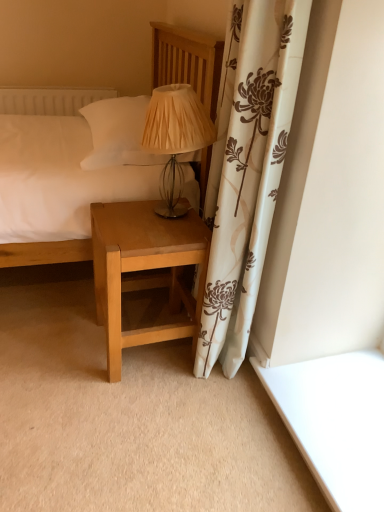
Question: In which direction should I rotate to look at light brown wood nightstand at lower center?

Choices:
 (A) right
 (B) left

Answer: (B)

Question: Considering the relative sizes of matte beige fabric lampshade at center and light brown wood nightstand at lower center in the image provided, is matte beige fabric lampshade at center shorter than light brown wood nightstand at lower center?

Choices:
 (A) no
 (B) yes

Answer: (B)

Question: Does matte beige fabric lampshade at center lie behind light brown wood nightstand at lower center?

Choices:
 (A) yes
 (B) no

Answer: (B)

Question: From the image's perspective, is matte beige fabric lampshade at center on light brown wood nightstand at lower center?

Choices:
 (A) yes
 (B) no

Answer: (A)

Question: Is matte beige fabric lampshade at center bigger than light brown wood nightstand at lower center?

Choices:
 (A) yes
 (B) no

Answer: (B)

Question: Is matte beige fabric lampshade at center completely or partially outside of light brown wood nightstand at lower center?

Choices:
 (A) yes
 (B) no

Answer: (A)

Question: Considering the relative sizes of matte beige fabric lampshade at center and light brown wood nightstand at lower center in the image provided, is matte beige fabric lampshade at center taller than light brown wood nightstand at lower center?

Choices:
 (A) yes
 (B) no

Answer: (B)

Question: Is matte beige fabric lampshade at center smaller than matte wood bed at center?

Choices:
 (A) no
 (B) yes

Answer: (B)

Question: Is matte beige fabric lampshade at center directly adjacent to matte wood bed at center?

Choices:
 (A) no
 (B) yes

Answer: (A)

Question: From the image's perspective, is matte beige fabric lampshade at center above matte wood bed at center?

Choices:
 (A) yes
 (B) no

Answer: (B)

Question: Is matte beige fabric lampshade at center looking in the opposite direction of matte wood bed at center?

Choices:
 (A) yes
 (B) no

Answer: (B)

Question: Can you confirm if matte beige fabric lampshade at center is thinner than matte wood bed at center?

Choices:
 (A) no
 (B) yes

Answer: (B)

Question: Considering the relative sizes of matte beige fabric lampshade at center and matte wood bed at center in the image provided, is matte beige fabric lampshade at center bigger than matte wood bed at center?

Choices:
 (A) no
 (B) yes

Answer: (A)

Question: Could you tell me if light brown wood nightstand at lower center is facing matte beige fabric lampshade at center?

Choices:
 (A) yes
 (B) no

Answer: (B)